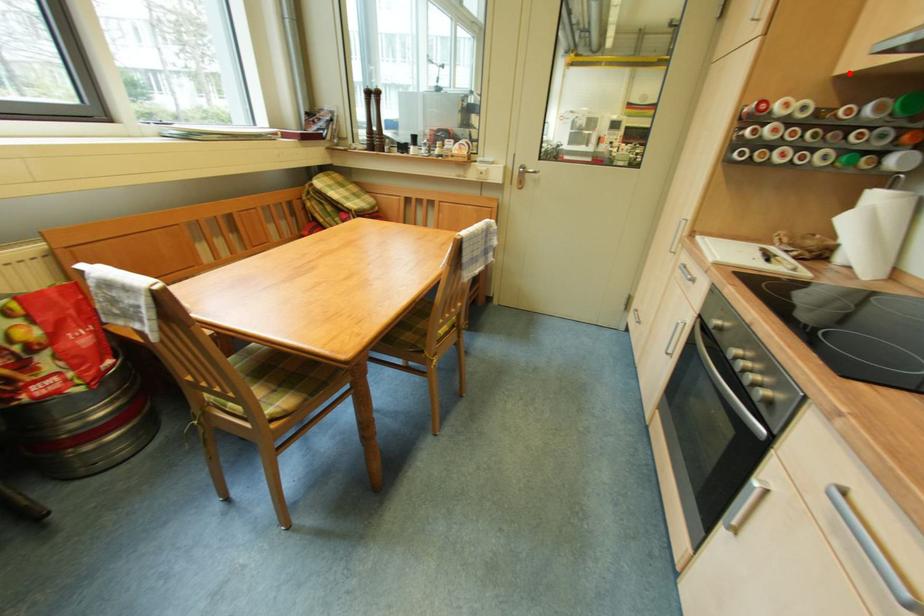
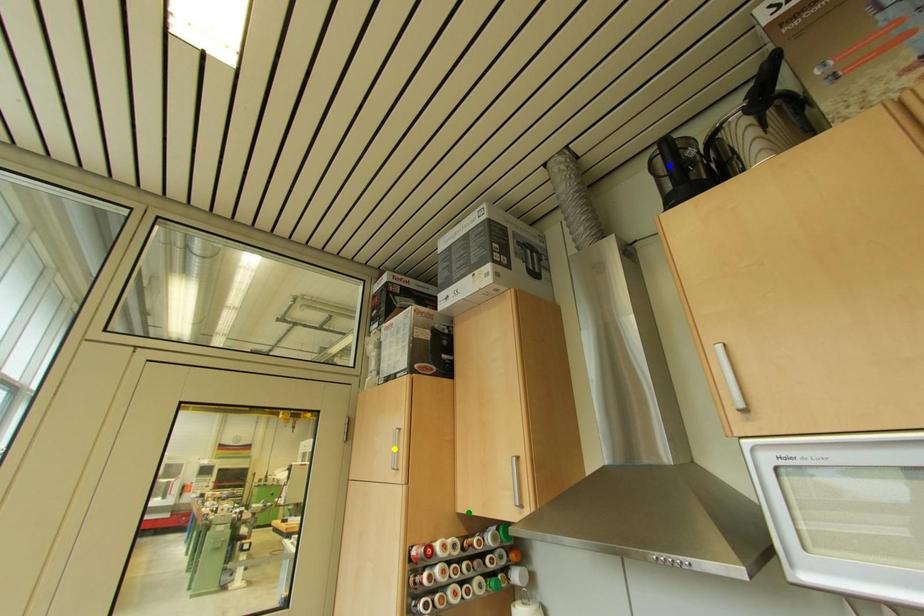
Question: I am providing you with two images of the same scene from different viewpoints. A red point is marked on the first image. You are given multiple points on the second image. Which spot in image 2 lines up with the point in image 1?

Choices:
 (A) green point
 (B) blue point
 (C) yellow point

Answer: (A)